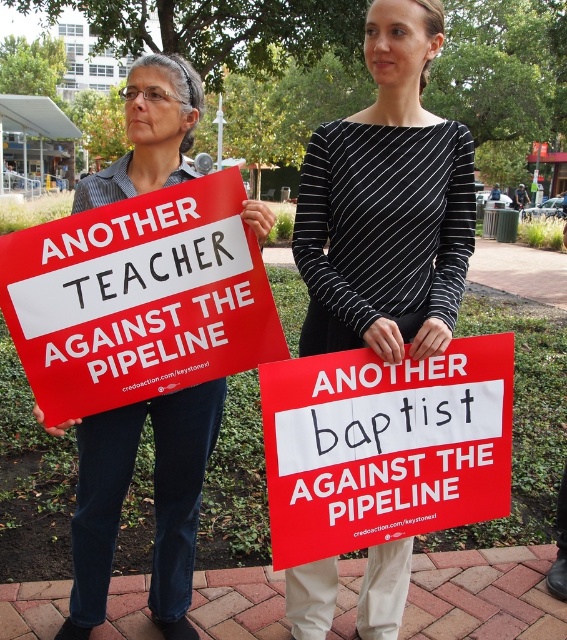
Question: Which point is farther to the camera?

Choices:
 (A) (391, 324)
 (B) (496, 376)
 (C) (179, 588)

Answer: (C)

Question: Which of the following is the farthest from the observer?

Choices:
 (A) matte black shirt at center
 (B) black striped shirt at center
 (C) red matte sign at left
 (D) red matte sign at center

Answer: (A)

Question: Considering the relative positions of red matte sign at center and matte black shirt at center in the image provided, where is red matte sign at center located with respect to matte black shirt at center?

Choices:
 (A) below
 (B) above

Answer: (B)

Question: Which point is farther to the camera?

Choices:
 (A) (433, 196)
 (B) (170, 177)
 (C) (56, 387)

Answer: (B)

Question: Is red matte sign at left thinner than matte black shirt at center?

Choices:
 (A) no
 (B) yes

Answer: (A)

Question: Considering the relative positions of black striped shirt at center and red matte sign at left in the image provided, where is black striped shirt at center located with respect to red matte sign at left?

Choices:
 (A) left
 (B) right

Answer: (B)